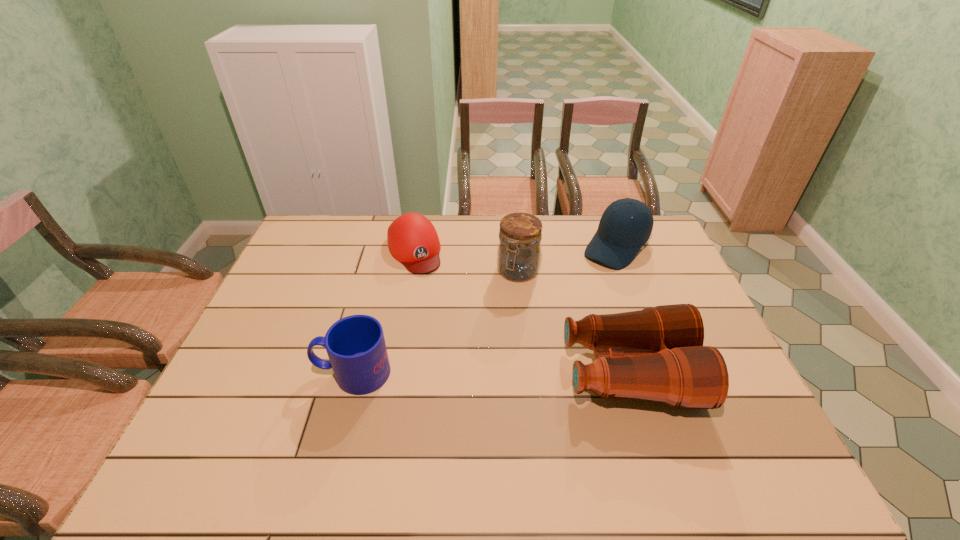
Where is `object positioned at the near edge`? This screenshot has height=540, width=960. object positioned at the near edge is located at coordinates (656, 354).

Identify the location of binoculars at the right edge. This screenshot has width=960, height=540. (656, 354).

This screenshot has height=540, width=960. What are the coordinates of `baseball cap present at the right edge` in the screenshot? It's located at (619, 237).

I want to click on object present at the far right corner, so click(x=619, y=237).

The height and width of the screenshot is (540, 960). Identify the location of object that is positioned at the near right corner. (656, 354).

Locate an element on the screen. The image size is (960, 540). vacant area at the far edge of the desktop is located at coordinates (470, 225).

Identify the location of vacant region at the near edge of the desktop. The image size is (960, 540). (315, 418).

The width and height of the screenshot is (960, 540). In the image, there is a desktop. Identify the location of vacant space at the left edge. tap(240, 394).

Identify the location of vacant area that lies between the tallest object and the shorter baseball cap. (466, 261).

Locate an element on the screen. Image resolution: width=960 pixels, height=540 pixels. vacant area that lies between the jar and the mug is located at coordinates (436, 322).